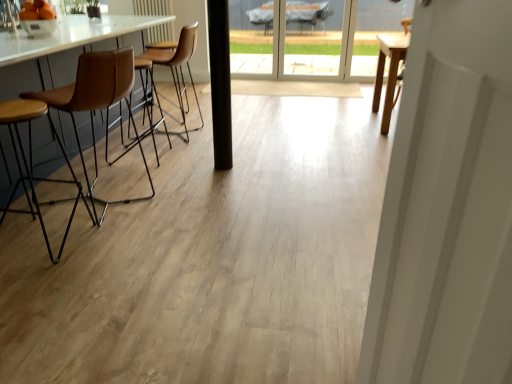
The image size is (512, 384). In order to click on empty space that is in between brown leather stool at left, which ranks as the 3th chair in back-to-front order, and brown leather stool at left, positioned as the second chair in front-to-back order in this screenshot , I will do `click(86, 229)`.